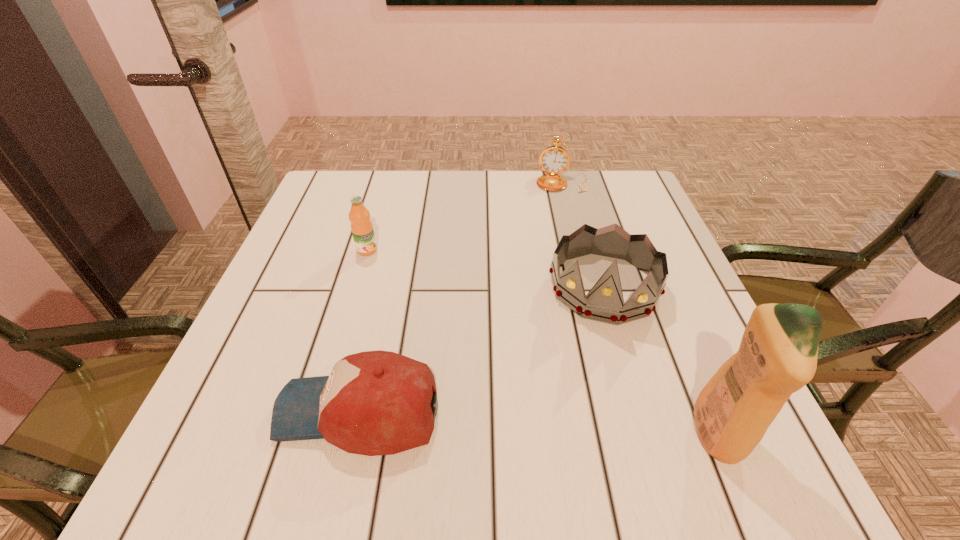
Find the location of a particular element. This screenshot has width=960, height=540. free space at the far left corner of the desktop is located at coordinates (332, 201).

Where is `vacant space at the near left corner of the desktop`? vacant space at the near left corner of the desktop is located at coordinates (213, 401).

In the image, there is a desktop. Identify the location of vacant region at the far right corner. Image resolution: width=960 pixels, height=540 pixels. (599, 202).

Locate an element on the screen. The width and height of the screenshot is (960, 540). vacant area between the pocket watch and the baseball cap is located at coordinates (461, 297).

Find the location of `free spot between the baseball cap and the orange juice`. free spot between the baseball cap and the orange juice is located at coordinates (363, 330).

Identify the location of free space between the baseball cap and the detergent. (538, 423).

Identify the location of vacant region between the baseball cap and the tiara. (481, 349).

What are the coordinates of `vacant point located between the tallest object and the baseball cap` in the screenshot? It's located at (538, 423).

The image size is (960, 540). In order to click on free space between the baseball cap and the orange juice in this screenshot , I will do `click(363, 330)`.

This screenshot has height=540, width=960. I want to click on free space between the baseball cap and the orange juice, so click(363, 330).